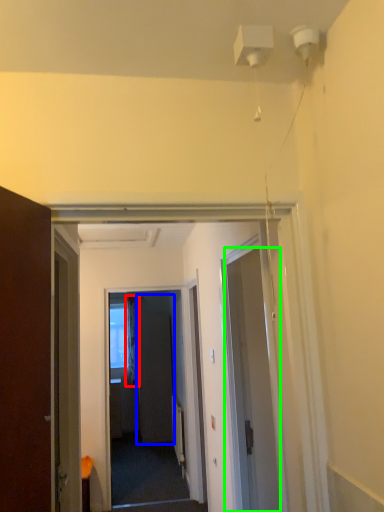
Question: Which object is the farthest from curtain (highlighted by a red box)? Choose among these: screen door (highlighted by a blue box) or door (highlighted by a green box).

Choices:
 (A) screen door
 (B) door

Answer: (B)